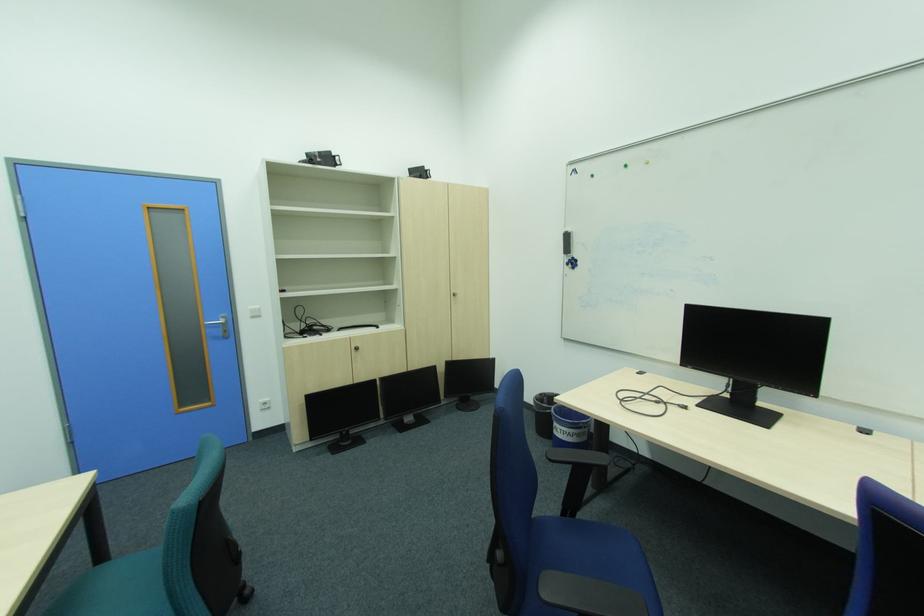
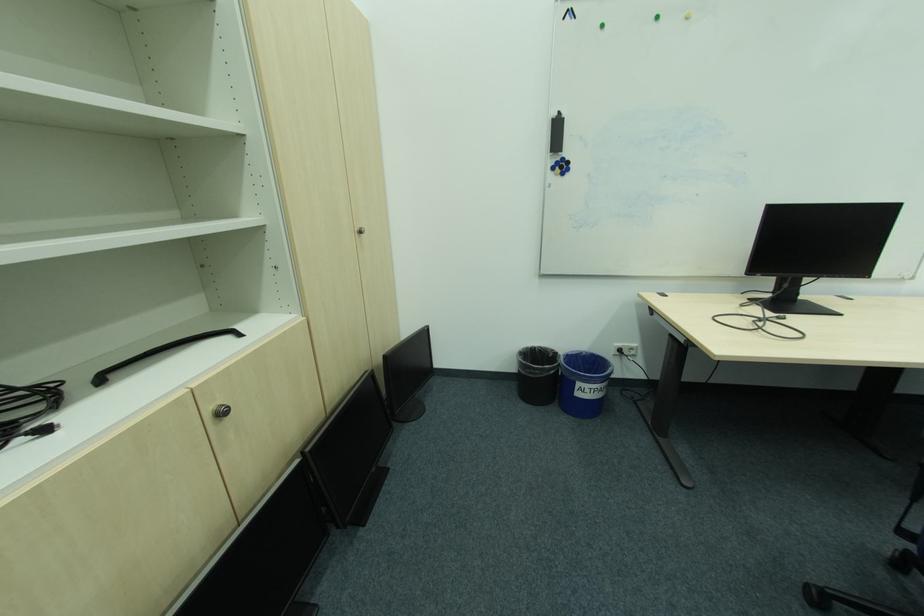
The point at (566, 431) is marked in the first image. Where is the corresponding point in the second image?

(593, 391)